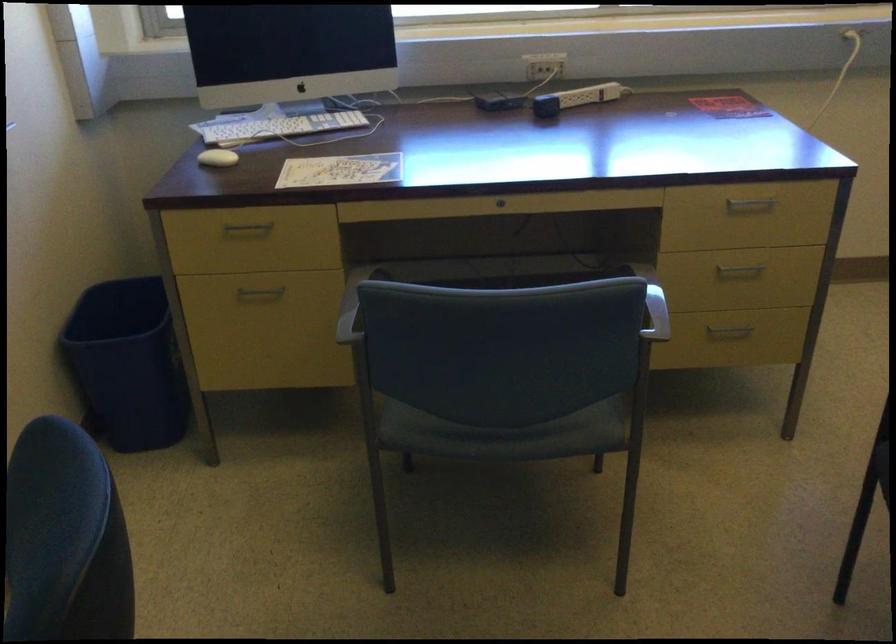
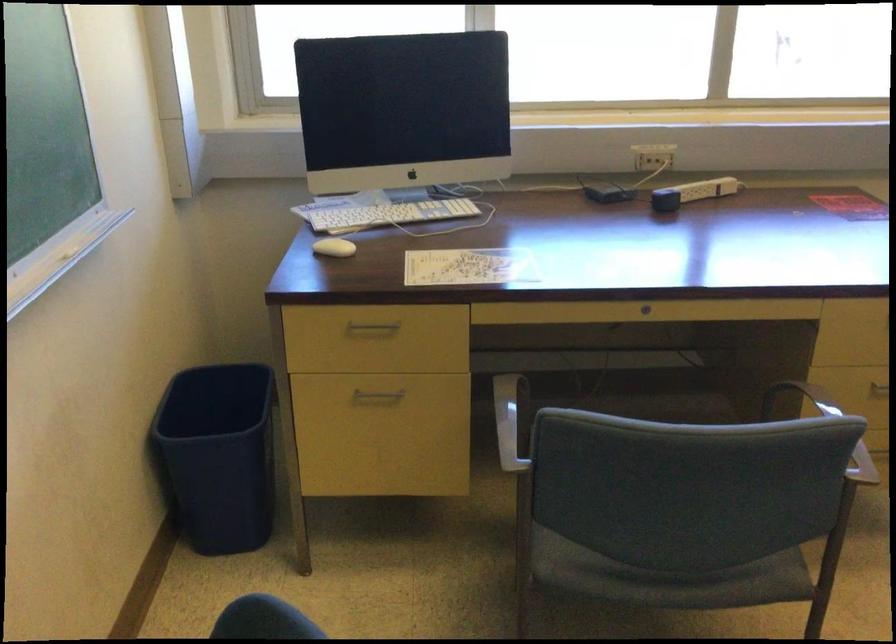
In the second image, find the point that corresponds to (x=358, y=305) in the first image.

(511, 421)